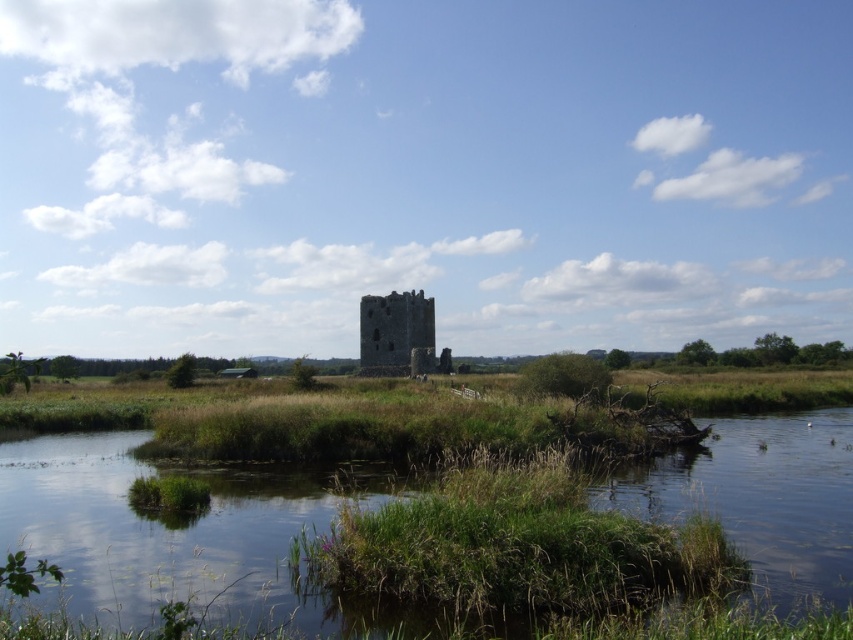
Can you confirm if green grassy river at lower center is thinner than rustic stone tower at center?

In fact, green grassy river at lower center might be wider than rustic stone tower at center.

Can you confirm if green grassy river at lower center is wider than rustic stone tower at center?

Yes, green grassy river at lower center is wider than rustic stone tower at center.

Who is more distant from viewer, (x=785, y=589) or (x=440, y=368)?

Positioned behind is point (x=440, y=368).

This screenshot has width=853, height=640. Find the location of `green grassy river at lower center`. green grassy river at lower center is located at coordinates (160, 531).